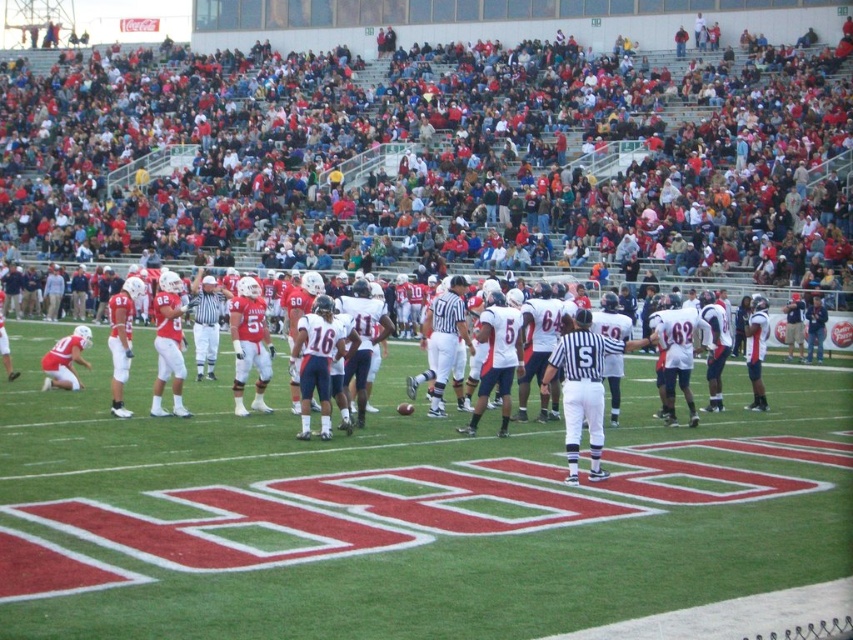
Is the position of red fabric crowd at upper center more distant than that of green grass football field at center?

Yes, red fabric crowd at upper center is behind green grass football field at center.

Is point (144, 150) less distant than point (160, 536)?

No, (144, 150) is further to viewer.

Find the location of a particular element. This screenshot has width=853, height=640. red fabric crowd at upper center is located at coordinates (437, 163).

Who is more distant from viewer, (241, 248) or (448, 288)?

Point (241, 248)

The image size is (853, 640). In order to click on red fabric crowd at upper center in this screenshot , I will do `click(437, 163)`.

Is point (155, 488) positioned before point (582, 420)?

Yes, it is in front of point (582, 420).

Where is `green grass football field at center`? The image size is (853, 640). green grass football field at center is located at coordinates pos(405,518).

Who is more forward, (x=178, y=428) or (x=596, y=454)?

Point (x=596, y=454) is in front.

Locate an element on the screen. The height and width of the screenshot is (640, 853). green grass football field at center is located at coordinates (405, 518).